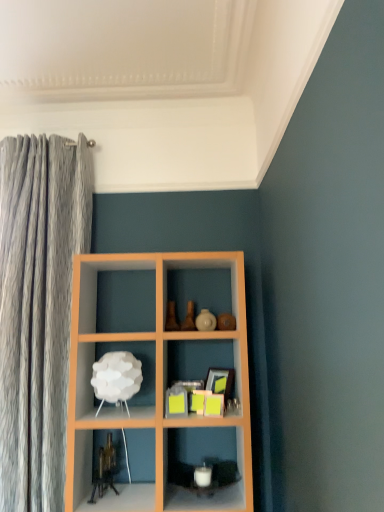
Find the location of `white matte lamp at lower left`. white matte lamp at lower left is located at coordinates (84, 382).

This screenshot has width=384, height=512. Describe the element at coordinates (84, 382) in the screenshot. I see `white matte lamp at lower left` at that location.

Identify the location of white matte lamp at lower left. (84, 382).